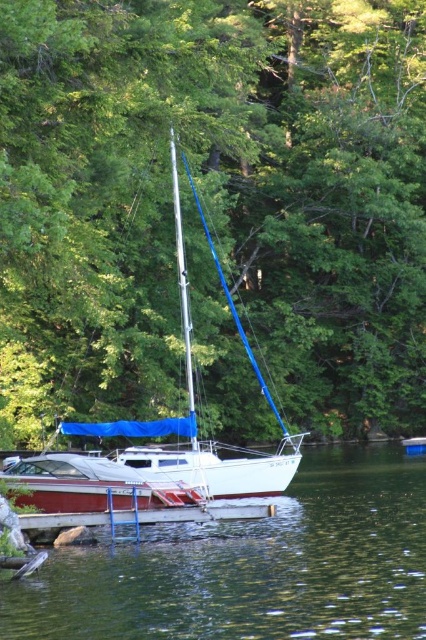
Question: Which point is closer to the camera?

Choices:
 (A) (158, 148)
 (B) (345, 596)

Answer: (B)

Question: Does green leafy tree at center have a greater width compared to brown wooden dock at lower center?

Choices:
 (A) no
 (B) yes

Answer: (B)

Question: From the image, what is the correct spatial relationship of green leafy tree at center in relation to brown wooden dock at lower center?

Choices:
 (A) right
 (B) left

Answer: (A)

Question: Which object is the farthest from the green liquid water at lower center?

Choices:
 (A) green leafy tree at center
 (B) brown wooden dock at lower center

Answer: (A)

Question: Among these objects, which one is farthest from the camera?

Choices:
 (A) green liquid water at lower center
 (B) green leafy tree at center
 (C) brown wooden dock at lower center

Answer: (C)

Question: Does green liquid water at lower center have a lesser width compared to brown wooden dock at lower center?

Choices:
 (A) yes
 (B) no

Answer: (B)